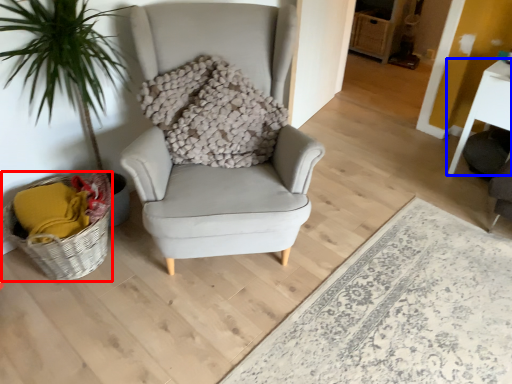
Question: Which object is further to the camera taking this photo, basket (highlighted by a red box) or table (highlighted by a blue box)?

Choices:
 (A) basket
 (B) table

Answer: (B)